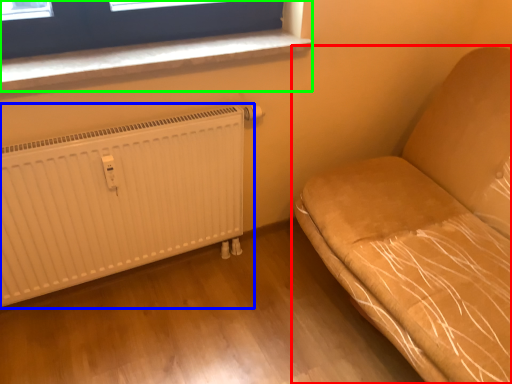
Question: Considering the real-world distances, which object is farthest from furniture (highlighted by a red box)? radiator (highlighted by a blue box) or window (highlighted by a green box)?

Choices:
 (A) radiator
 (B) window

Answer: (B)